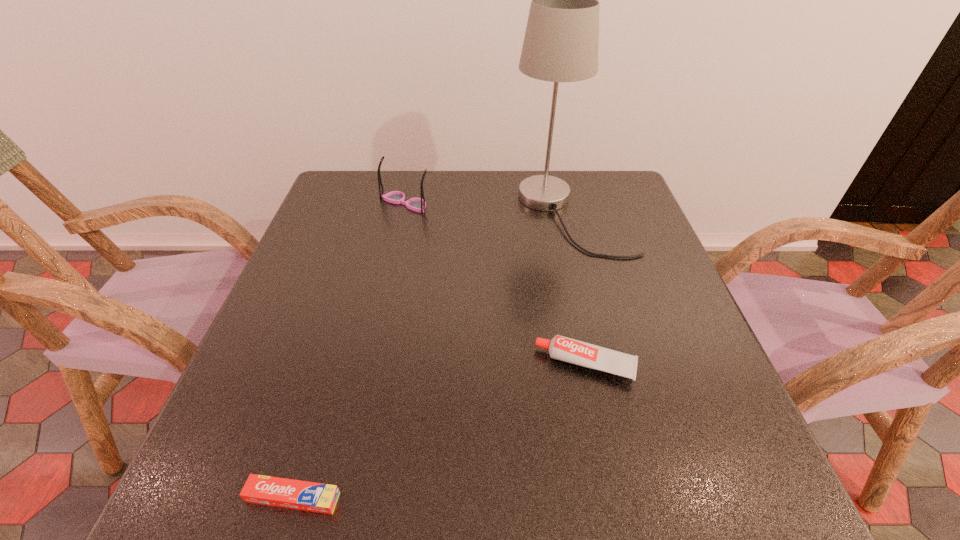
Where is `the tallest object`? The image size is (960, 540). the tallest object is located at coordinates (561, 42).

The height and width of the screenshot is (540, 960). In order to click on the second tallest object in this screenshot , I will do click(x=416, y=204).

Identify the location of the taller toothpaste. (565, 349).

Where is `the third farthest object`? the third farthest object is located at coordinates (x=565, y=349).

Locate an element on the screen. This screenshot has height=540, width=960. the shorter toothpaste is located at coordinates click(302, 495).

Where is `the left toothpaste`? the left toothpaste is located at coordinates (302, 495).

Image resolution: width=960 pixels, height=540 pixels. What are the coordinates of `blank space located 0.080m on the left of the table lamp` in the screenshot? It's located at tap(484, 215).

At what (x,y) coordinates should I click in order to perform the action: click on vacant space located 0.120m on the right of the spectacles. Please return your answer as a coordinate pair (x, y). The width and height of the screenshot is (960, 540). Looking at the image, I should click on (474, 203).

Where is `free space located on the front of the third farthest object`? Image resolution: width=960 pixels, height=540 pixels. free space located on the front of the third farthest object is located at coordinates (602, 440).

Identify the location of blank space located on the right of the nearest object. tap(379, 497).